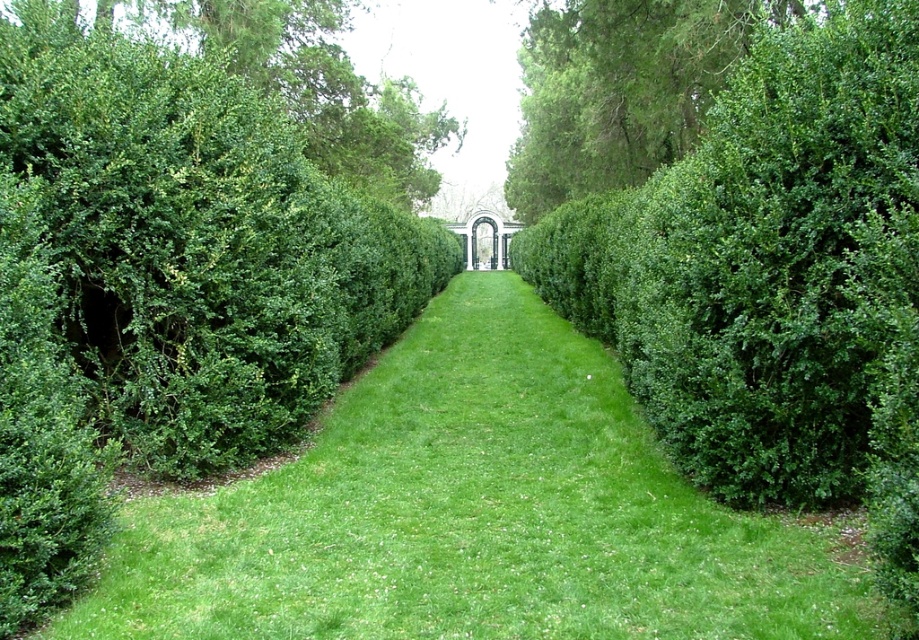
You are standing at the entrance of the garden pathway. You want to walk straight ahead towards the archway. Is the green grass at center at point (x=475, y=513) in your path?

The green grass at center is located at point (x=475, y=513), which is in the center of the pathway. Since the pathway leads straight towards the archway, the green grass at center at point (x=475, y=513) is indeed in your path.